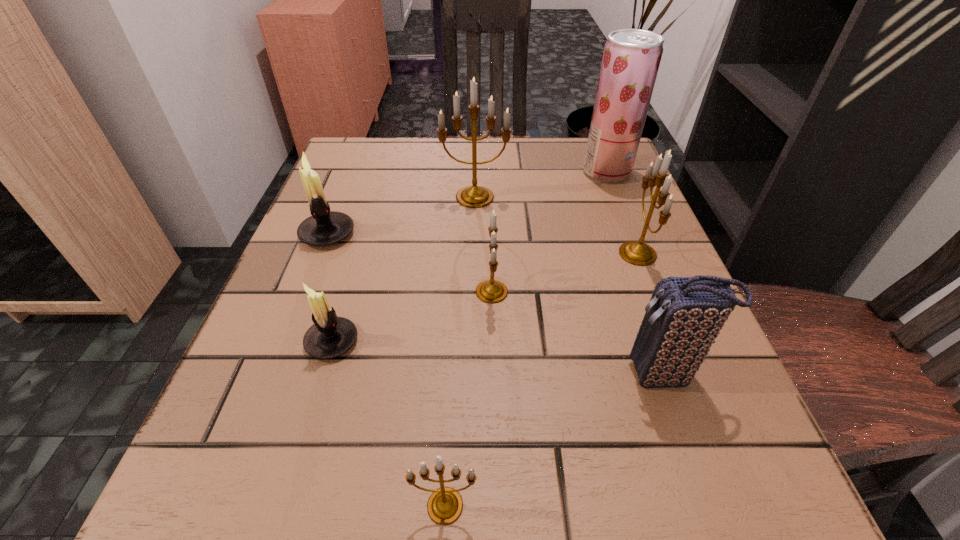
Identify the location of the farthest object. (631, 58).

Locate an element on the screen. This screenshot has height=540, width=960. fruit juice is located at coordinates (631, 58).

Identify the location of the second farthest object. (474, 196).

I want to click on the biggest gold candelabrum, so click(x=474, y=196).

This screenshot has width=960, height=540. What are the coordinates of `the fifth shortest candelabrum` in the screenshot? It's located at (638, 253).

You are a GUI agent. You are given a task and a screenshot of the screen. Output one action in this format:
    pyautogui.click(x=<x>, y=<y>)
    Task: Click on the second biggest gold candelabrum
    This screenshot has height=540, width=960.
    Given the screenshot: What is the action you would take?
    pyautogui.click(x=638, y=253)

You are a GUI agent. You are given a task and a screenshot of the screen. Output one action in this format:
    pyautogui.click(x=<x>, y=<y>)
    Task: Click on the clutch bag
    
    Given the screenshot: What is the action you would take?
    pyautogui.click(x=684, y=316)

The height and width of the screenshot is (540, 960). What are the coordinates of `the farther white candle holder` in the screenshot? It's located at (325, 227).

Where is `the second smallest gold candelabrum`? the second smallest gold candelabrum is located at coordinates (491, 291).

You are a GUI agent. You are given a task and a screenshot of the screen. Output one action in this format:
    pyautogui.click(x=<x>, y=<y>)
    Task: Click on the second nearest candelabrum
    This screenshot has width=960, height=540.
    Given the screenshot: What is the action you would take?
    pyautogui.click(x=330, y=336)